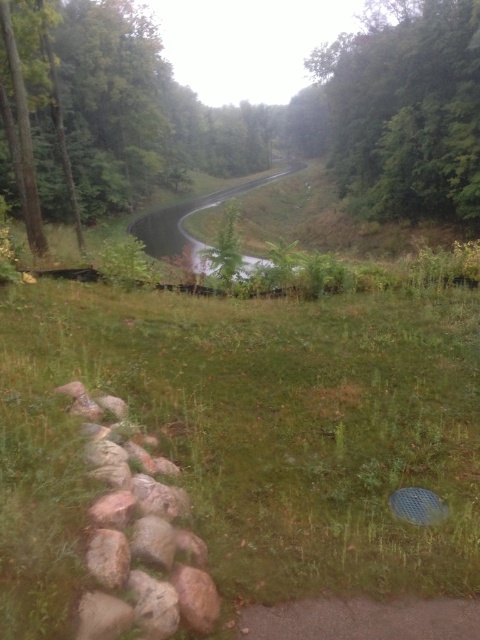
You are a gardener planning to plant a new flower bed. You see the green grassy at center and the green leafy tree at upper right. Which area would be better for planting flowers, considering the position of the tree?

The green grassy at center is positioned under the green leafy tree at upper right, so planting flowers there might be challenging due to limited sunlight. A better spot would be away from the tree where sunlight is more accessible.

You are a hiker standing on the green grassy at center and looking towards the green leafy tree at upper right. Which object is closer to you?

The green grassy at center is closer to you because it is in front of the green leafy tree at upper right.

You are a hiker standing at the beginning of the road and want to walk towards the green leafy tree at upper right. Which direction should you turn to avoid the green leafy tree at upper center?

You should turn to the right to avoid the green leafy tree at upper center, as it is closer to you and located to the left side of the path leading towards the green leafy tree at upper right.